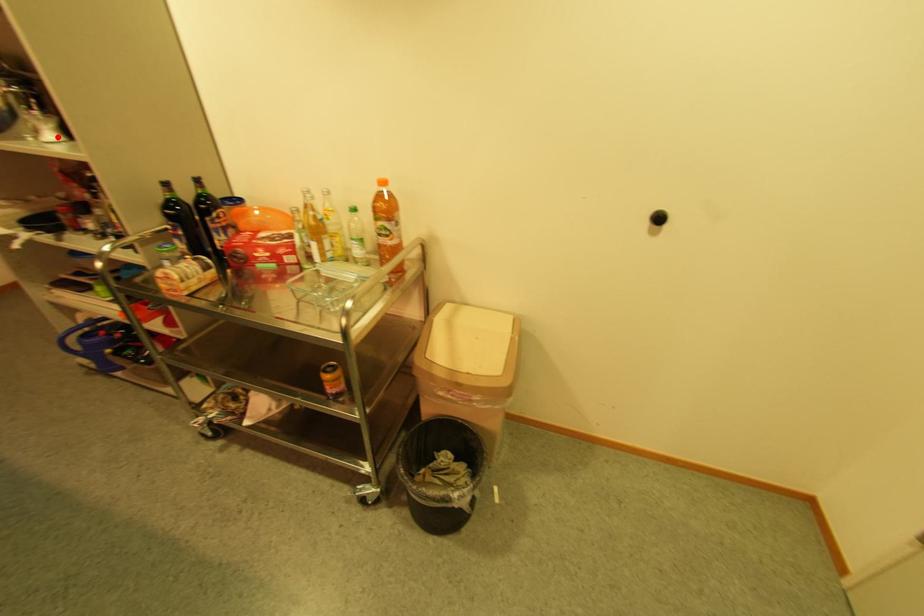
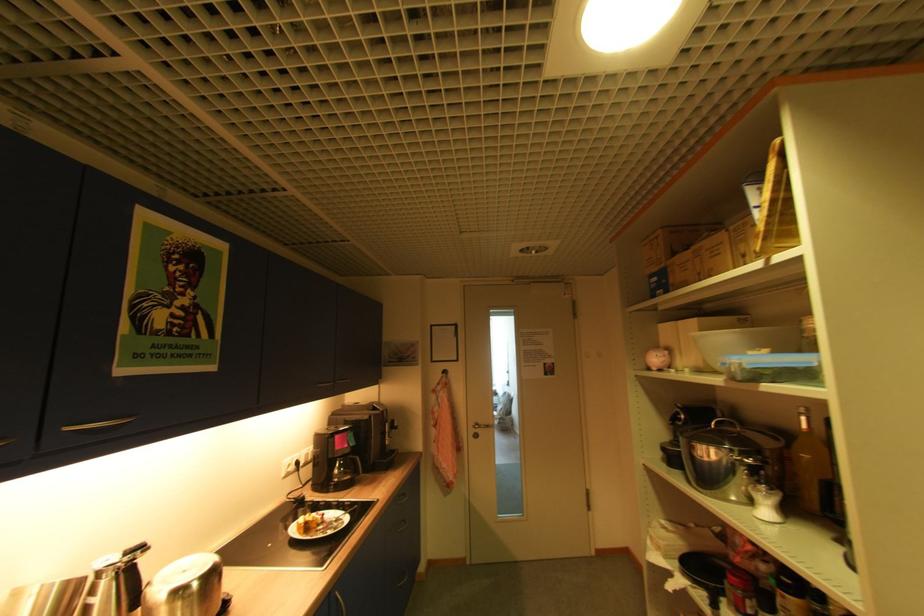
Locate, in the second image, the point that corresponds to the highlighted location in the first image.

(772, 513)